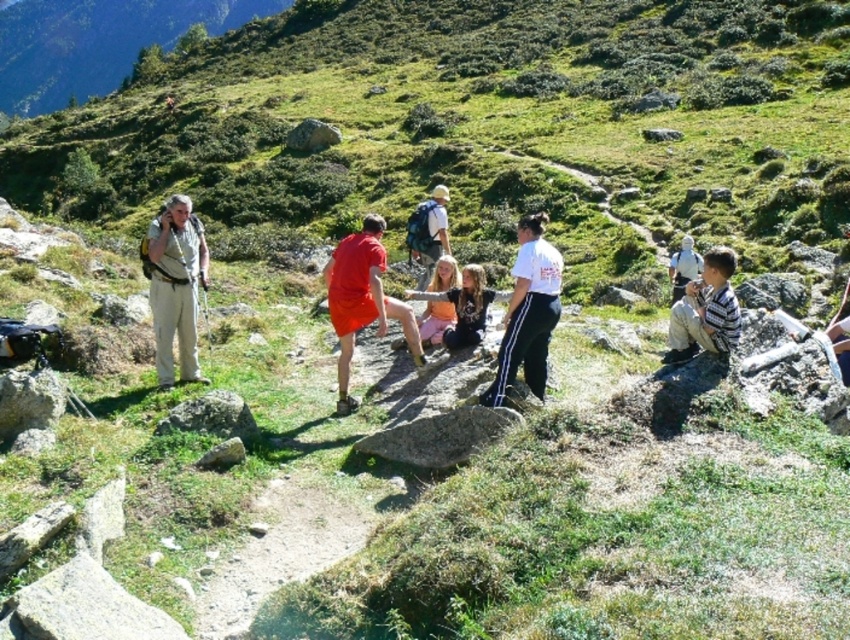
Who is more distant from viewer, (706,342) or (428,269)?

The point (428,269) is more distant.

This screenshot has height=640, width=850. What do you see at coordinates (706, 310) in the screenshot?
I see `striped shirt at right` at bounding box center [706, 310].

Locate an element on the screen. striped shirt at right is located at coordinates [x=706, y=310].

Is point (332, 321) more distant than point (683, 285)?

That is False.

Does point (335, 321) come in front of point (678, 296)?

Yes, point (335, 321) is in front of point (678, 296).

Measure the distance between point (x=348, y=376) and camera.

They are 11.48 meters apart.

This screenshot has width=850, height=640. I want to click on matte red shorts at center, so click(x=361, y=300).

Is point (710, 349) behind point (456, 320)?

No, (710, 349) is in front of (456, 320).

Which is below, striped shirt at right or matte pink shirt at center?

Positioned lower is striped shirt at right.

What do you see at coordinates (706, 310) in the screenshot?
I see `striped shirt at right` at bounding box center [706, 310].

Locate an element on the screen. striped shirt at right is located at coordinates (706, 310).